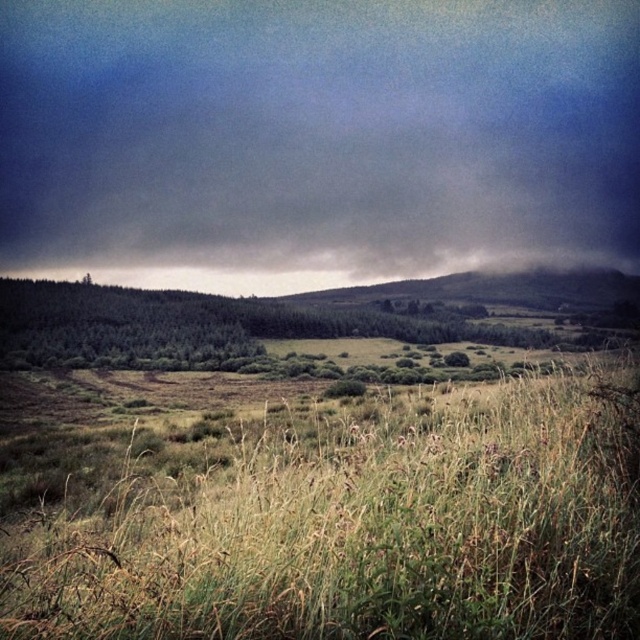
Does dark gray cloud at upper center appear on the left side of green grassy field at center?

Yes, dark gray cloud at upper center is to the left of green grassy field at center.

Can you confirm if dark gray cloud at upper center is positioned above green grassy field at center?

Yes.

Which is in front, point (476, 129) or point (141, 529)?

Positioned in front is point (141, 529).

Identify the location of dark gray cloud at upper center. (316, 138).